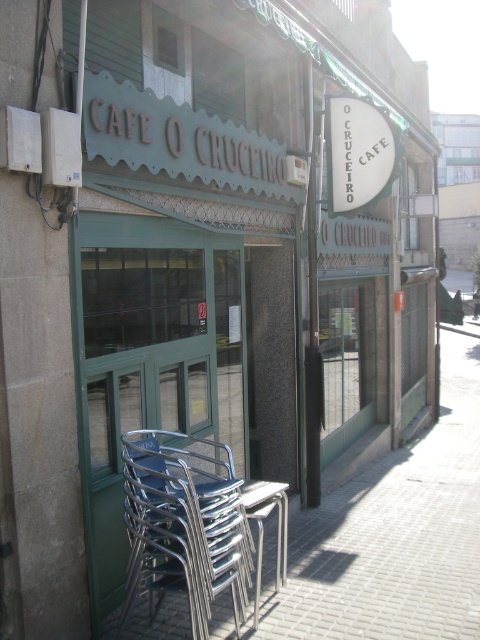
Which is below, metallic silver pavement at lower left or metallic silver chair at lower left?

metallic silver pavement at lower left is lower down.

Which is behind, point (446, 492) or point (160, 573)?

The point (446, 492) is more distant.

Who is more distant from viewer, (446, 422) or (154, 528)?

Point (446, 422)

Locate an element on the screen. This screenshot has width=480, height=640. metallic silver pavement at lower left is located at coordinates (393, 534).